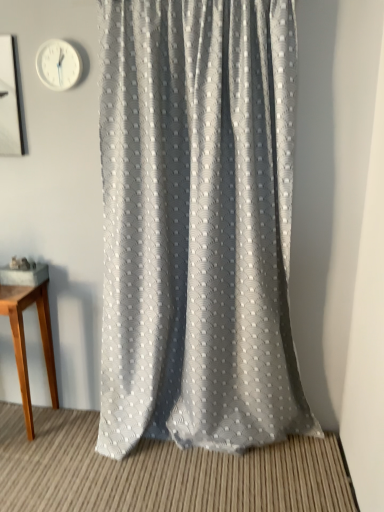
Question: From a real-world perspective, is light brown wooden table at left located higher than white plastic clock at upper left?

Choices:
 (A) no
 (B) yes

Answer: (A)

Question: Is light brown wooden table at left oriented away from white plastic clock at upper left?

Choices:
 (A) yes
 (B) no

Answer: (B)

Question: Can you confirm if light brown wooden table at left is thinner than white plastic clock at upper left?

Choices:
 (A) yes
 (B) no

Answer: (B)

Question: Does light brown wooden table at left touch white plastic clock at upper left?

Choices:
 (A) no
 (B) yes

Answer: (A)

Question: Considering the relative sizes of light brown wooden table at left and white plastic clock at upper left in the image provided, is light brown wooden table at left shorter than white plastic clock at upper left?

Choices:
 (A) yes
 (B) no

Answer: (B)

Question: Considering the positions of white plastic clock at upper left and light brown wooden table at left in the image, is white plastic clock at upper left wider or thinner than light brown wooden table at left?

Choices:
 (A) thin
 (B) wide

Answer: (A)

Question: From the image's perspective, is white plastic clock at upper left positioned above or below light brown wooden table at left?

Choices:
 (A) below
 (B) above

Answer: (B)

Question: Is point [77, 77] positioned closer to the camera than point [3, 297]?

Choices:
 (A) closer
 (B) farther

Answer: (A)

Question: Considering the relative positions of white plastic clock at upper left and light brown wooden table at left in the image provided, is white plastic clock at upper left to the left or to the right of light brown wooden table at left?

Choices:
 (A) left
 (B) right

Answer: (B)

Question: Considering the positions of textured gray curtain at center and light brown wooden table at left in the image, is textured gray curtain at center wider or thinner than light brown wooden table at left?

Choices:
 (A) wide
 (B) thin

Answer: (A)

Question: From a real-world perspective, is textured gray curtain at center positioned above or below light brown wooden table at left?

Choices:
 (A) below
 (B) above

Answer: (B)

Question: Relative to light brown wooden table at left, is textured gray curtain at center in front or behind?

Choices:
 (A) front
 (B) behind

Answer: (A)

Question: Is textured gray curtain at center taller or shorter than light brown wooden table at left?

Choices:
 (A) tall
 (B) short

Answer: (A)

Question: Is light brown wooden table at left in front of or behind white plastic clock at upper left in the image?

Choices:
 (A) behind
 (B) front

Answer: (A)

Question: From a real-world perspective, is light brown wooden table at left above or below white plastic clock at upper left?

Choices:
 (A) above
 (B) below

Answer: (B)